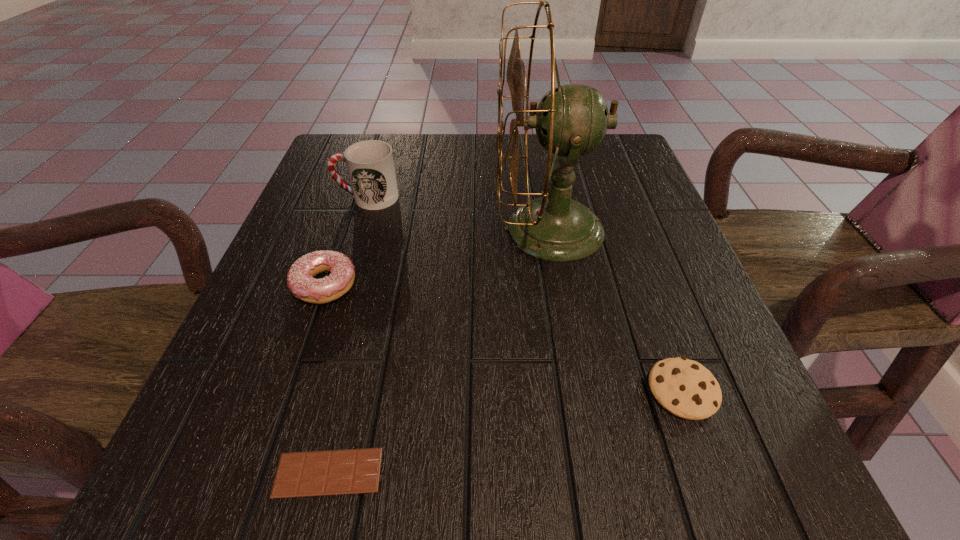
At what (x,y) coordinates should I click in order to perform the action: click on object that is positioned at the near left corner. Please return your answer as a coordinate pair (x, y). Looking at the image, I should click on (318, 473).

Where is `object that is at the far right corner`? The width and height of the screenshot is (960, 540). object that is at the far right corner is located at coordinates (571, 120).

Identify the location of free space at the far edge of the desktop. Image resolution: width=960 pixels, height=540 pixels. (405, 175).

The image size is (960, 540). I want to click on vacant space at the near edge of the desktop, so click(485, 461).

In the image, there is a desktop. Identify the location of vacant space at the left edge. This screenshot has height=540, width=960. (243, 373).

Find the location of a particular element. The image size is (960, 540). vacant space at the right edge of the desktop is located at coordinates (625, 194).

In the image, there is a desktop. Where is `vacant space at the near left corner`? The width and height of the screenshot is (960, 540). vacant space at the near left corner is located at coordinates (298, 448).

I want to click on blank space at the near right corner of the desktop, so click(726, 478).

The width and height of the screenshot is (960, 540). What are the coordinates of `free space that is in between the fan and the cookie` in the screenshot? It's located at (616, 309).

You are a GUI agent. You are given a task and a screenshot of the screen. Output one action in this format:
    pyautogui.click(x=<x>, y=<y>)
    Task: Click on the vacant space that is in between the chocolate bar and the second tallest object
    
    Given the screenshot: What is the action you would take?
    pyautogui.click(x=348, y=335)